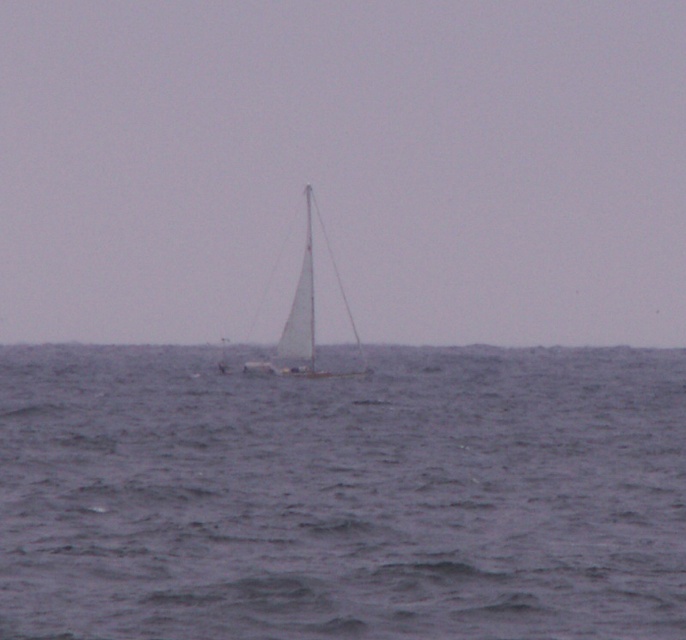
Who is lower down, gray water at center or white sailboat at center?

gray water at center

Does gray water at center have a lesser width compared to white sailboat at center?

In fact, gray water at center might be wider than white sailboat at center.

Is point (462, 625) in front of point (307, 308)?

Yes, it is in front of point (307, 308).

You are a GUI agent. You are given a task and a screenshot of the screen. Output one action in this format:
    pyautogui.click(x=<x>, y=<y>)
    Task: Click on the gray water at center
    
    Given the screenshot: What is the action you would take?
    pyautogui.click(x=343, y=496)